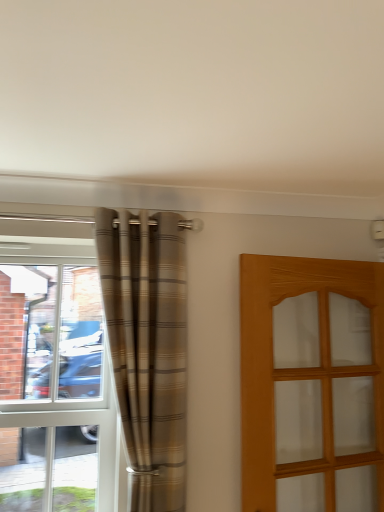
Question: Does clear glass window at left have a lesser width compared to plaid fabric curtain at left?

Choices:
 (A) yes
 (B) no

Answer: (A)

Question: Is clear glass window at left far away from plaid fabric curtain at left?

Choices:
 (A) no
 (B) yes

Answer: (A)

Question: From the image's perspective, is clear glass window at left located beneath plaid fabric curtain at left?

Choices:
 (A) yes
 (B) no

Answer: (A)

Question: Is clear glass window at left smaller than plaid fabric curtain at left?

Choices:
 (A) no
 (B) yes

Answer: (B)

Question: Can you confirm if clear glass window at left is positioned to the left of plaid fabric curtain at left?

Choices:
 (A) no
 (B) yes

Answer: (B)

Question: Do you think light brown wooden door at right is within plaid fabric curtain at left, or outside of it?

Choices:
 (A) outside
 (B) inside

Answer: (A)

Question: Visually, is light brown wooden door at right positioned to the left or to the right of plaid fabric curtain at left?

Choices:
 (A) right
 (B) left

Answer: (A)

Question: Is light brown wooden door at right in front of or behind plaid fabric curtain at left in the image?

Choices:
 (A) front
 (B) behind

Answer: (A)

Question: From a real-world perspective, is light brown wooden door at right above or below plaid fabric curtain at left?

Choices:
 (A) above
 (B) below

Answer: (B)

Question: Based on their sizes in the image, would you say light brown wooden door at right is bigger or smaller than clear glass window at left?

Choices:
 (A) small
 (B) big

Answer: (B)

Question: From a real-world perspective, is light brown wooden door at right positioned above or below clear glass window at left?

Choices:
 (A) below
 (B) above

Answer: (A)

Question: In terms of height, does light brown wooden door at right look taller or shorter compared to clear glass window at left?

Choices:
 (A) short
 (B) tall

Answer: (A)

Question: Is light brown wooden door at right inside or outside of clear glass window at left?

Choices:
 (A) inside
 (B) outside

Answer: (B)

Question: Relative to light brown wooden door at right, is clear glass window at left in front or behind?

Choices:
 (A) front
 (B) behind

Answer: (B)

Question: From the image's perspective, is clear glass window at left above or below light brown wooden door at right?

Choices:
 (A) below
 (B) above

Answer: (B)